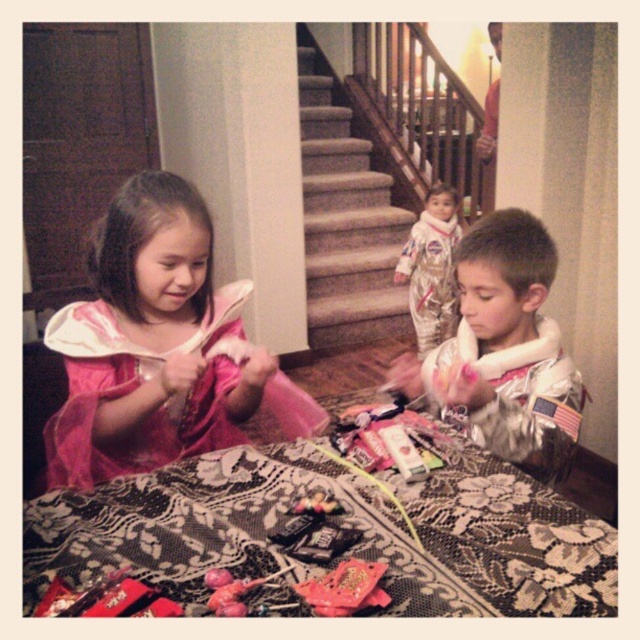
Question: Where is shiny metallic toy at center located in relation to rubberized plastic toy at lower center in the image?

Choices:
 (A) left
 (B) right

Answer: (B)

Question: Is gold metallic astronaut suit at center to the left of shiny metallic toy at center from the viewer's perspective?

Choices:
 (A) no
 (B) yes

Answer: (A)

Question: Which point is closer to the camera?

Choices:
 (A) (531, 444)
 (B) (227, 609)

Answer: (B)

Question: Which point is farther to the camera?

Choices:
 (A) rubberized plastic toy at lower center
 (B) metallic pink toy at center
 (C) pink satin dress at center

Answer: (C)

Question: Which point is closer to the camera?

Choices:
 (A) metallic pink toy at center
 (B) silver metallic astronaut suit at center
 (C) gold metallic astronaut suit at center
 (D) shiny metallic toy at center

Answer: (D)

Question: Is silver metallic astronaut suit at center to the left of shiny metallic toy at center from the viewer's perspective?

Choices:
 (A) yes
 (B) no

Answer: (B)